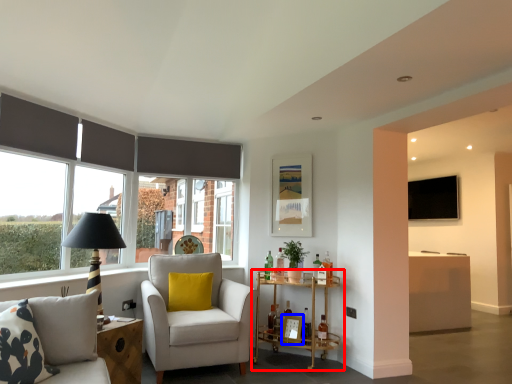
Question: Which object appears closest to the camera in this image, table (highlighted by a red box) or picture frame (highlighted by a blue box)?

Choices:
 (A) table
 (B) picture frame

Answer: (A)